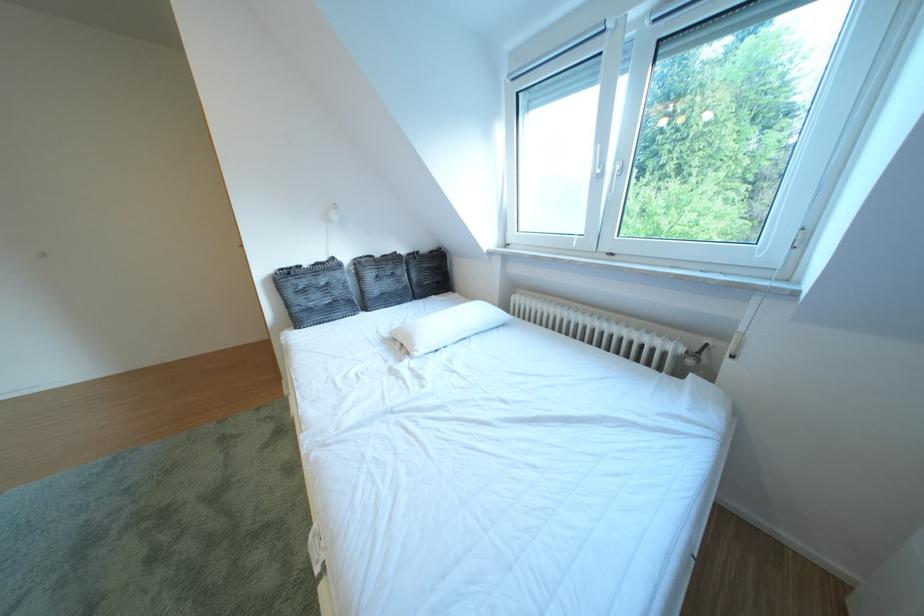
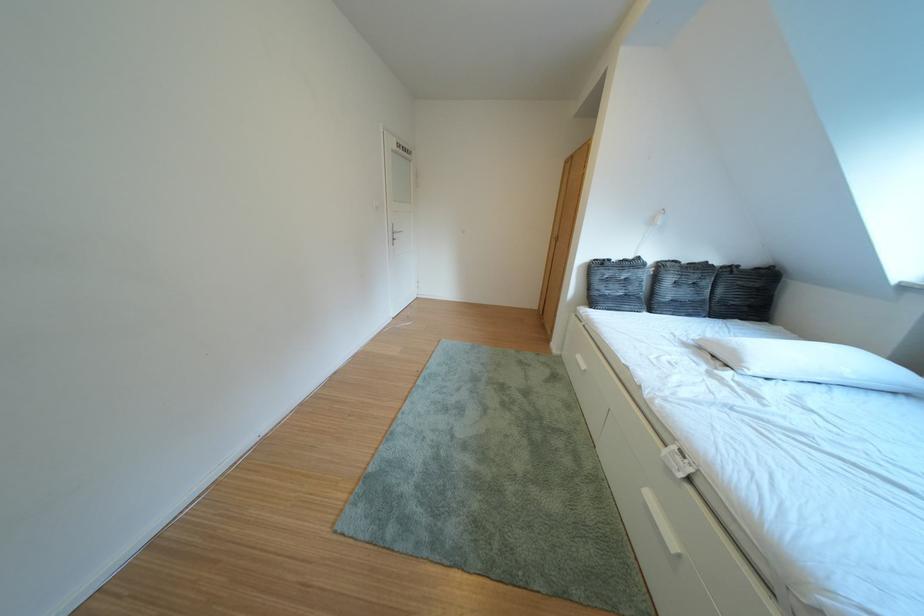
Question: The images are taken continuously from a first-person perspective. In which direction is your viewpoint rotating?

Choices:
 (A) Left
 (B) Right
 (C) Up
 (D) Down

Answer: (A)